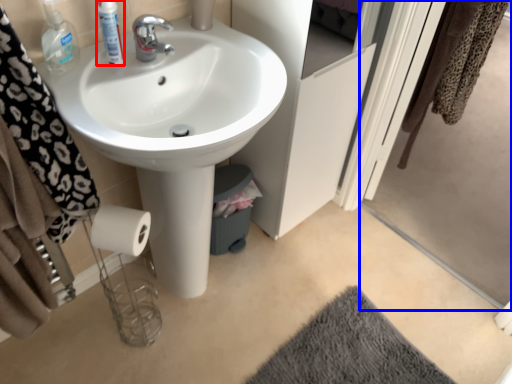
Question: Which point is closer to the camera, mouthwash (highlighted by a red box) or screen door (highlighted by a blue box)?

Choices:
 (A) mouthwash
 (B) screen door

Answer: (B)